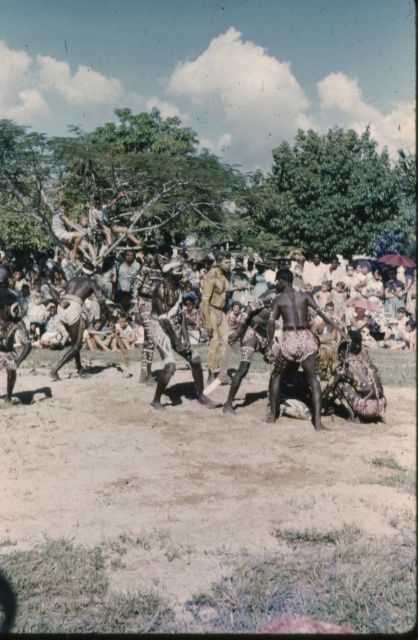
Question: Does printed fabric shorts at center appear on the right side of textured brown cloth at center?

Choices:
 (A) yes
 (B) no

Answer: (A)

Question: From the image, what is the correct spatial relationship of printed fabric shorts at center in relation to camouflage fabric uniform at center?

Choices:
 (A) below
 (B) above

Answer: (A)

Question: Which point is farther from the camera taking this photo?

Choices:
 (A) (173, 323)
 (B) (78, 324)
 (C) (282, 268)
 (D) (188, 417)

Answer: (C)

Question: Which of the following is the farthest from the observer?

Choices:
 (A) brown sandy ground at center
 (B) brown textured fabric at center
 (C) camouflage fabric uniform at center
 (D) textured brown cloth at center

Answer: (D)

Question: Which is nearer to the brown sandy ground at center?

Choices:
 (A) camouflage fabric uniform at center
 (B) printed fabric shorts at center

Answer: (B)

Question: Where is brown textured fabric at center located in relation to textured brown cloth at center in the image?

Choices:
 (A) above
 (B) below

Answer: (B)